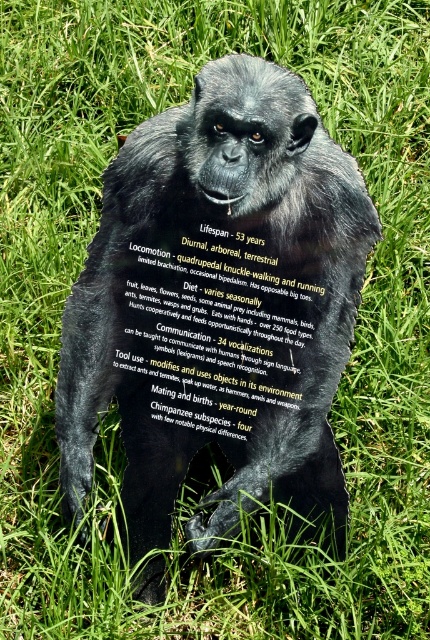
You are a delivery person who needs to place a new black plastic sign at center next to the shiny black statue at center. Can you determine if there is enough space between them based on their widths?

The shiny black statue at center might be wider than black plastic sign at center, so there might not be enough space between them. Please check the actual width before placing the sign.

You are a visitor at a park and see the shiny black statue at center and the black plastic sign at center. Which object is taller?

The shiny black statue at center is taller than the black plastic sign at center.